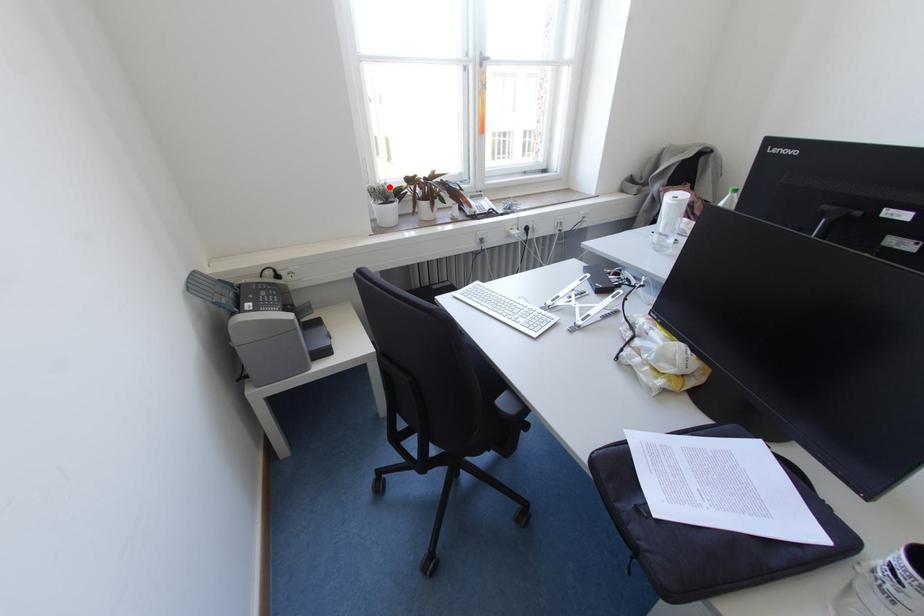
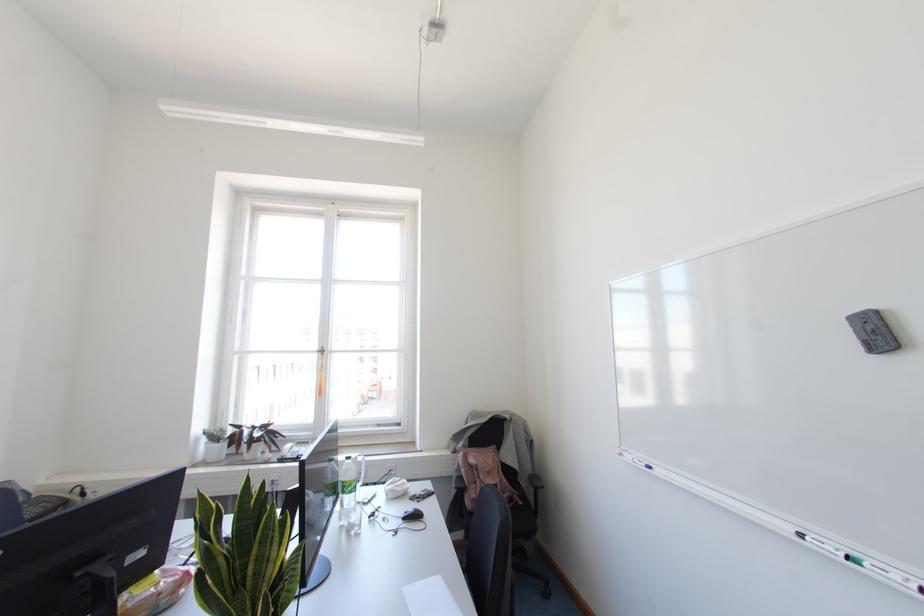
Find the pixel in the second image that matches the highlighted location in the first image.

(223, 431)